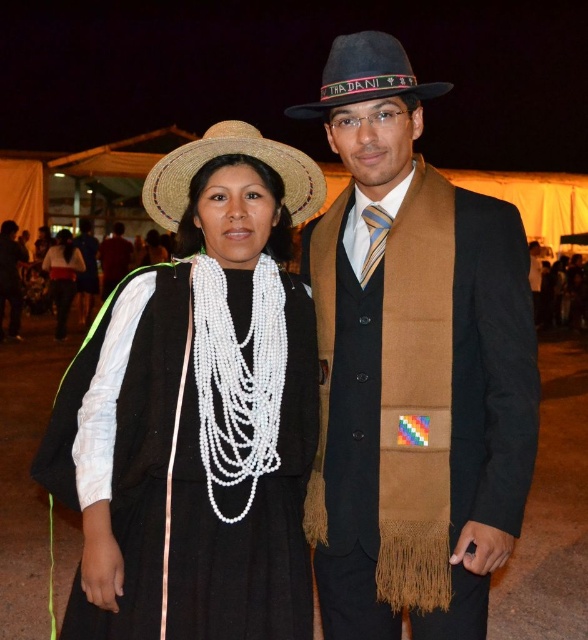
Measure the distance between black felt cowboy hat at upper center and black woolen vest at center.

The distance of black felt cowboy hat at upper center from black woolen vest at center is 59.20 feet.

Describe the element at coordinates (366, 76) in the screenshot. This screenshot has height=640, width=588. I see `black felt cowboy hat at upper center` at that location.

The image size is (588, 640). I want to click on black felt cowboy hat at upper center, so click(x=366, y=76).

Find the location of `black felt cowboy hat at upper center`. black felt cowboy hat at upper center is located at coordinates (366, 76).

Consider the image. Is black felt cowboy hat at upper center above white beaded necklace at center?

Yes.

Is black felt cowboy hat at upper center positioned in front of white beaded necklace at center?

That is True.

Who is more forward, (298, 108) or (65, 280)?

Point (298, 108) is in front.

This screenshot has height=640, width=588. In order to click on black felt cowboy hat at upper center in this screenshot , I will do `click(366, 76)`.

Between brown woolen scarf at center and black felt cowboy hat at upper center, which one has less height?

Standing shorter between the two is black felt cowboy hat at upper center.

Can you confirm if brown woolen scarf at center is positioned to the left of black felt cowboy hat at upper center?

Incorrect, brown woolen scarf at center is not on the left side of black felt cowboy hat at upper center.

Between point (413, 320) and point (349, 76), which one is positioned behind?

The point (413, 320) is more distant.

Locate an element on the screen. The height and width of the screenshot is (640, 588). brown woolen scarf at center is located at coordinates (412, 368).